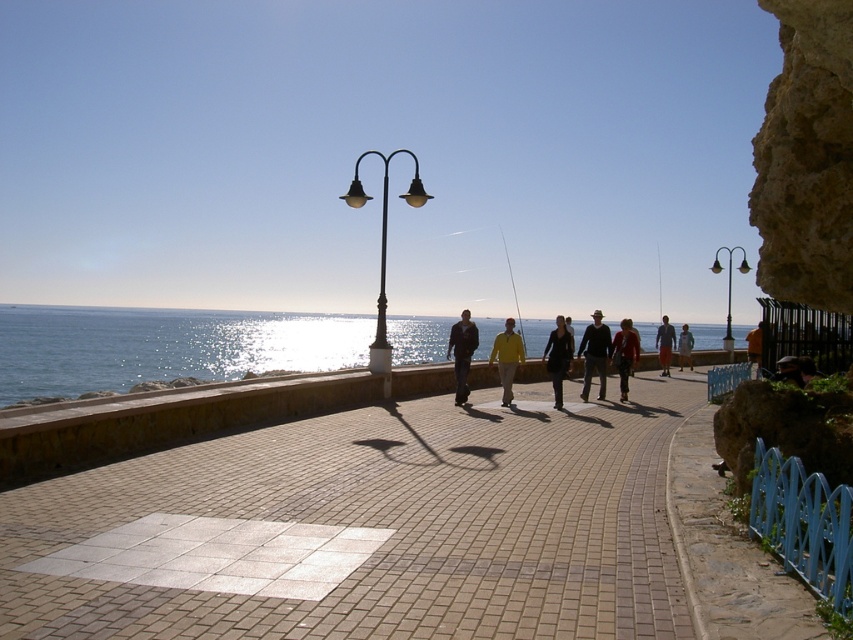
Measure the distance between yellow matte jacket at center and camera.

yellow matte jacket at center is 14.67 meters from camera.

Does yellow matte jacket at center appear under dark brown leather jacket at center?

Actually, yellow matte jacket at center is above dark brown leather jacket at center.

The height and width of the screenshot is (640, 853). Identify the location of yellow matte jacket at center. (508, 356).

In order to click on yellow matte jacket at center in this screenshot , I will do `click(508, 356)`.

Can you confirm if shiny blue water at center is shorter than metallic pole at center?

Correct, shiny blue water at center is not as tall as metallic pole at center.

Between shiny blue water at center and metallic pole at center, which one has more height?

metallic pole at center is taller.

Describe the element at coordinates (161, 346) in the screenshot. I see `shiny blue water at center` at that location.

At what (x,y) coordinates should I click in order to perform the action: click on shiny blue water at center. Please return your answer as a coordinate pair (x, y). Looking at the image, I should click on (161, 346).

Does brick paved walkway at center have a lesser height compared to metallic pole at center?

Indeed, brick paved walkway at center has a lesser height compared to metallic pole at center.

From the picture: Can you confirm if brick paved walkway at center is positioned below metallic pole at center?

Yes.

Does point (663, 518) lie in front of point (372, 358)?

Yes.

Image resolution: width=853 pixels, height=640 pixels. Find the location of `brick paved walkway at center`. brick paved walkway at center is located at coordinates (367, 529).